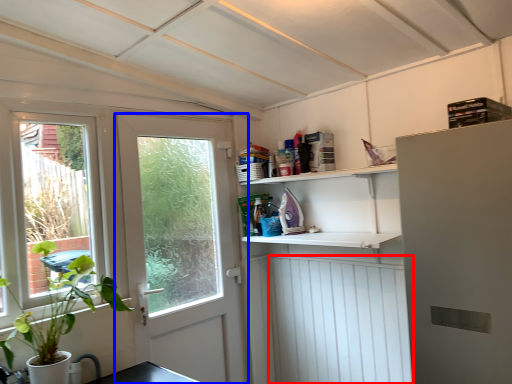
Question: Among these objects, which one is nearest to the camera, screen door (highlighted by a red box) or door (highlighted by a blue box)?

Choices:
 (A) screen door
 (B) door

Answer: (B)